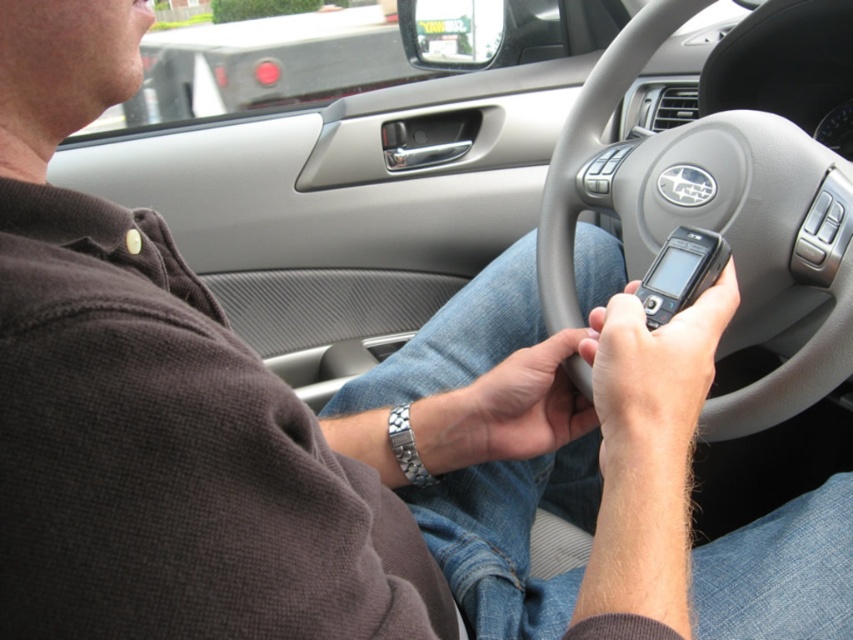
You are a passenger in the car and want to hand the driver a snack from the back seat. The snack is on the floor behind you. To reach the driver, you need to pass the snack over the gray matte steering wheel at center. Is the snack within reach of the driver without moving the steering wheel?

The gray matte steering wheel at center is located at point (x=711, y=221). Since the snack is on the floor behind you, it would require moving the steering wheel to reach it, so the snack is not within reach without moving the steering wheel.

You are a passenger in the car and want to reach the gray matte steering wheel at center to adjust the radio. Considering your arm length is 24 inches, can you comfortably reach it?

The gray matte steering wheel at center is 24.88 inches from the viewer. Since your arm length is 24 inches, you cannot comfortably reach it as the distance is slightly longer than your arm span.

Consider the image. You are a passenger in the car and want to use the black matte phone at center. Can you easily reach it without moving the gray matte steering wheel at center?

The black matte phone at center is behind the gray matte steering wheel at center, so it would be difficult to reach without moving the steering wheel first.